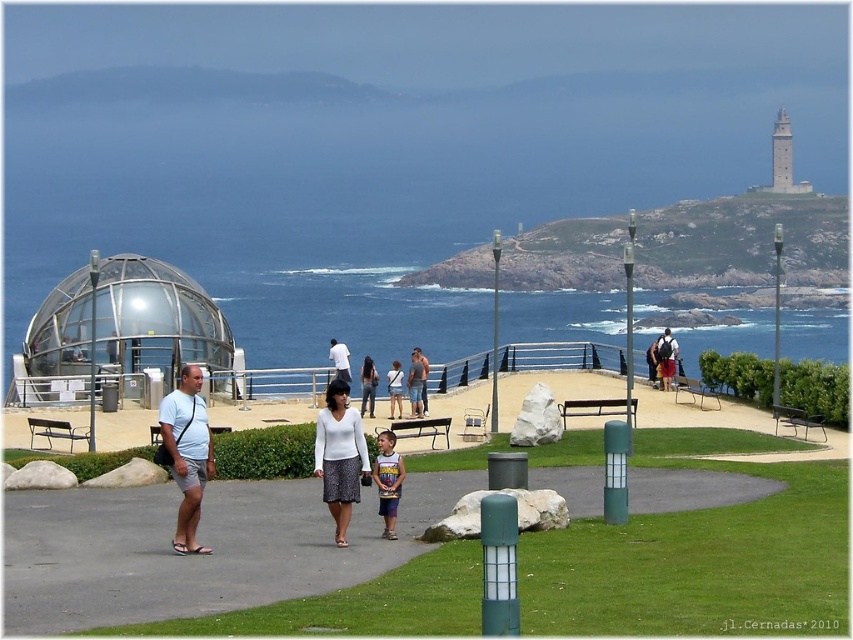
You are standing at the glass dome structure and want to take a photo of both point [340,424] and point [337,358]. Which point should you focus on first to ensure both are in focus?

Point [340,424] is closer to the camera than point [337,358], so you should focus on point [340,424] first to ensure both are in focus.

From the picture: You are standing on the coastal pathway and see two people wearing a white matte sweater at center and a light blue shirt at center. Which person is closer to you?

The white matte sweater at center is closer to the viewer than the light blue shirt at center, so the person wearing the white matte sweater at center is closer to you.